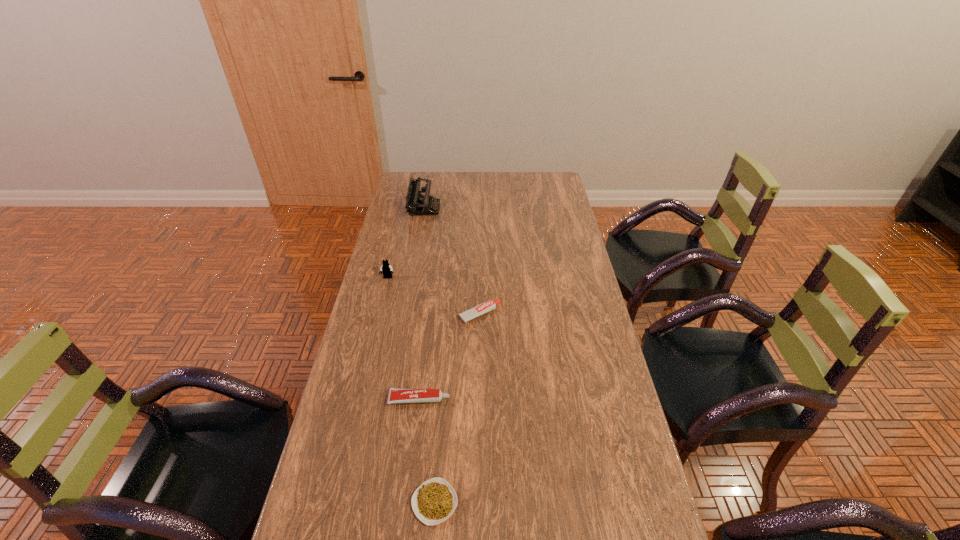
Identify which object is located as the fourth nearest to the third nearest object. Please provide its 2D coordinates. Your answer should be formatted as a tuple, i.e. [(x, y)], where the tuple contains the x and y coordinates of a point satisfying the conditions above.

[(434, 501)]

Find the location of a particular element. object that is the fourth closest one to the right toothpaste is located at coordinates (434, 501).

Where is `free region that satisfies the following two spatial constraints: 1. on the front side of the right toothpaste; 2. at the nozzle of the left toothpaste`? free region that satisfies the following two spatial constraints: 1. on the front side of the right toothpaste; 2. at the nozzle of the left toothpaste is located at coordinates (480, 399).

This screenshot has width=960, height=540. I want to click on free region that satisfies the following two spatial constraints: 1. at the nozzle of the shortest object; 2. on the left side of the left toothpaste, so click(x=407, y=502).

Locate an element on the screen. The width and height of the screenshot is (960, 540). vacant space that satisfies the following two spatial constraints: 1. on the front-facing side of the fourth shortest object; 2. on the left side of the shortest object is located at coordinates (334, 502).

Find the location of a particular element. The height and width of the screenshot is (540, 960). vacant space that satisfies the following two spatial constraints: 1. on the back side of the legume; 2. on the right side of the right toothpaste is located at coordinates pyautogui.click(x=448, y=314).